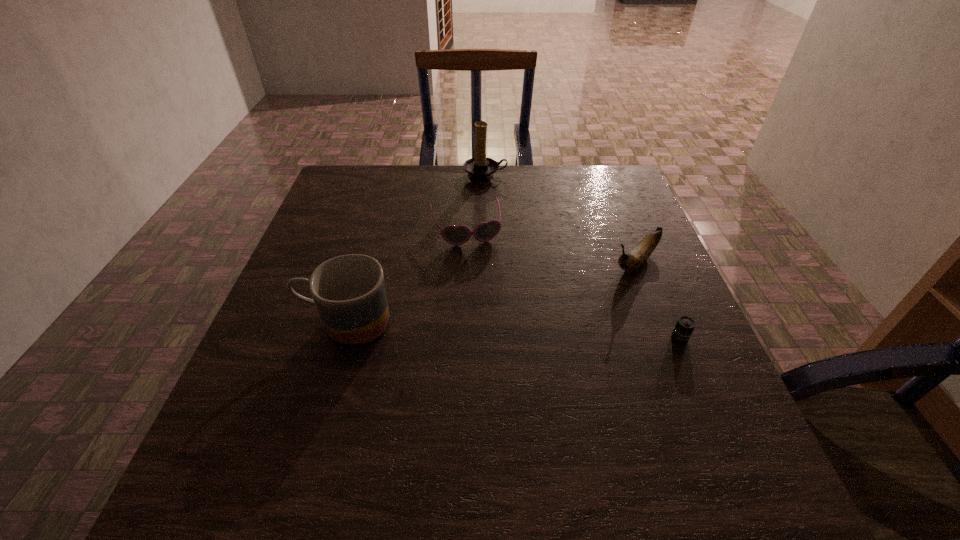
You are a GUI agent. You are given a task and a screenshot of the screen. Output one action in this format:
    pyautogui.click(x=<x>, y=<y>)
    Task: Click on the banana that is at the right edge
    
    Given the screenshot: What is the action you would take?
    pyautogui.click(x=633, y=260)

What are the coordinates of `vacant space at the far edge of the desktop` in the screenshot? It's located at (453, 197).

Where is `vacant point at the near edge`? vacant point at the near edge is located at coordinates (434, 446).

In the image, there is a desktop. Where is `blank space at the left edge`? This screenshot has width=960, height=540. blank space at the left edge is located at coordinates (368, 210).

Locate an element on the screen. free spot at the right edge of the desktop is located at coordinates [601, 210].

What are the coordinates of `vacant area at the far left corner` in the screenshot? It's located at (375, 183).

The width and height of the screenshot is (960, 540). What are the coordinates of `vacant area at the far right corner of the desktop` in the screenshot? It's located at (611, 198).

Image resolution: width=960 pixels, height=540 pixels. I want to click on vacant area that lies between the banana and the mug, so click(491, 292).

Identify the location of vacant space that's between the shortest object and the farthest object. The height and width of the screenshot is (540, 960). (583, 257).

I want to click on vacant space that's between the third tallest object and the sunglasses, so click(550, 246).